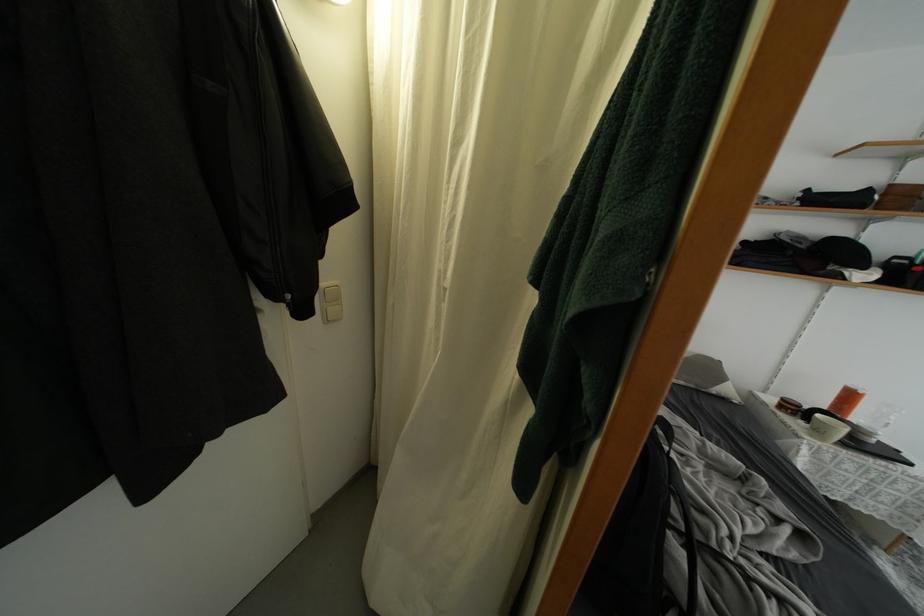
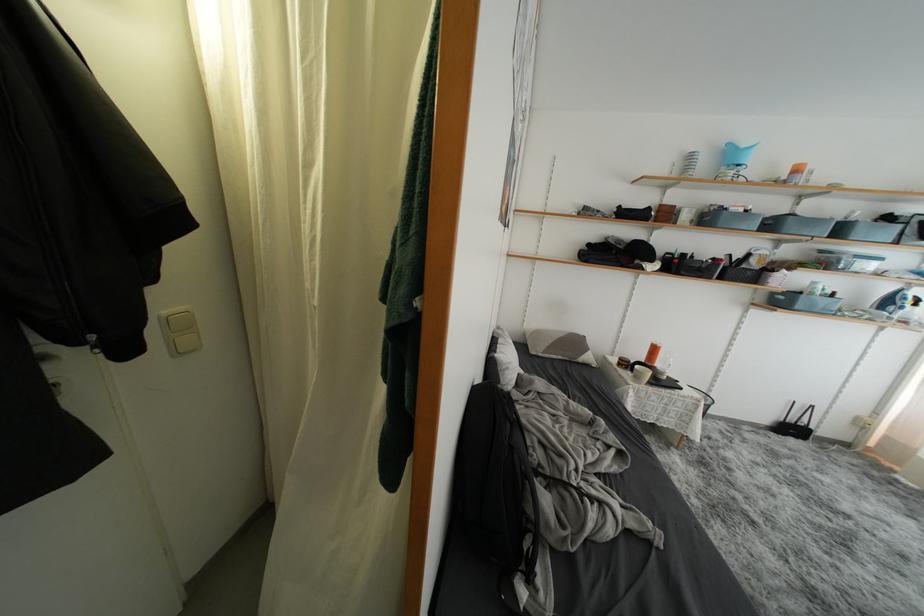
Question: How did the camera likely rotate?

Choices:
 (A) Left
 (B) Right
 (C) Up
 (D) Down

Answer: (B)